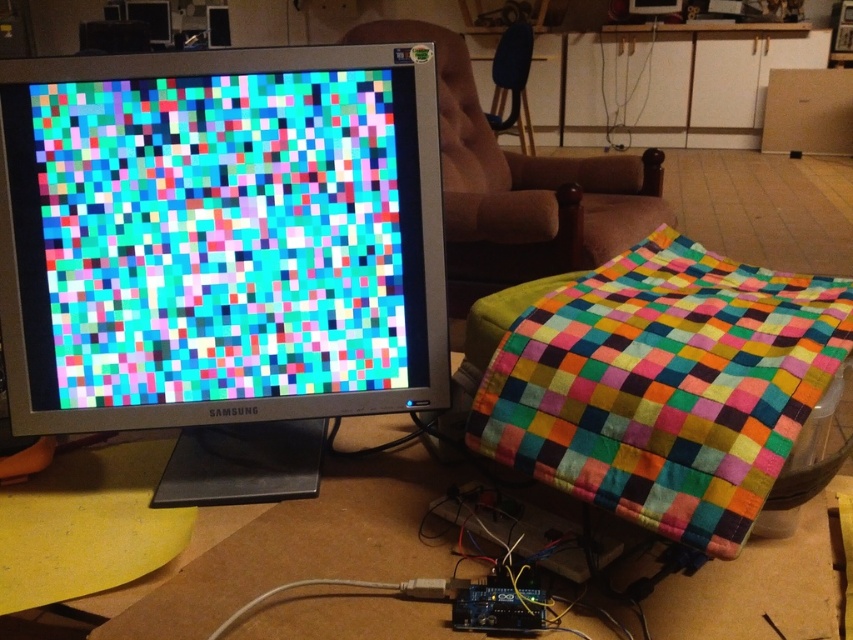
Looking at this image, is multicolored quilt at center to the left of brown fabric armchair at center from the viewer's perspective?

No, multicolored quilt at center is not to the left of brown fabric armchair at center.

Which is in front, point (786, 365) or point (485, 132)?

Point (786, 365) is in front.

Does point (624, 397) lie behind point (575, 195)?

No, (624, 397) is closer to viewer.

Where is `multicolored quilt at center`? The image size is (853, 640). multicolored quilt at center is located at coordinates (664, 385).

Is brown fabric armchair at center taller than velvet brown armchair at upper center?

Yes, brown fabric armchair at center is taller than velvet brown armchair at upper center.

Between point (460, 97) and point (525, 60), which one is positioned in front?

Point (460, 97)

Find the location of `brown fabric armchair at center`. brown fabric armchair at center is located at coordinates [520, 186].

Is cardboard at lower left shorter than brown fabric armchair at center?

Yes, cardboard at lower left is shorter than brown fabric armchair at center.

Is point (328, 564) positioned behind point (396, 28)?

No, it is not.

Who is more distant from viewer, (447, 554) or (564, 202)?

Point (564, 202)

Image resolution: width=853 pixels, height=640 pixels. Identify the location of cardboard at lower left. (305, 547).